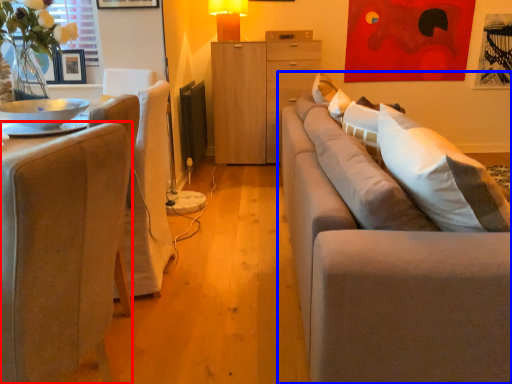
Question: Among these objects, which one is nearest to the camera, chair (highlighted by a red box) or studio couch (highlighted by a blue box)?

Choices:
 (A) chair
 (B) studio couch

Answer: (A)